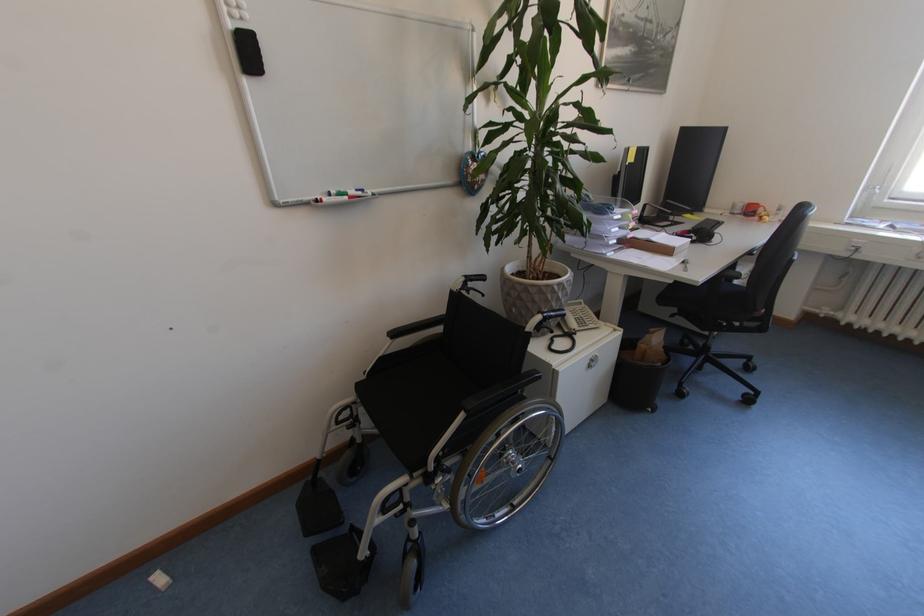
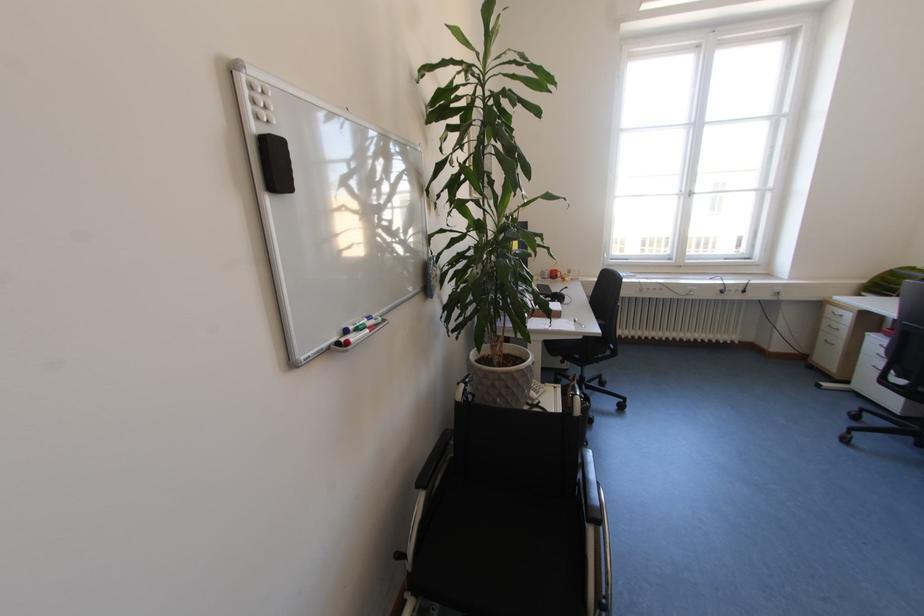
In the second image, find the point that corresponds to the point at 341,193 in the first image.

(359, 329)